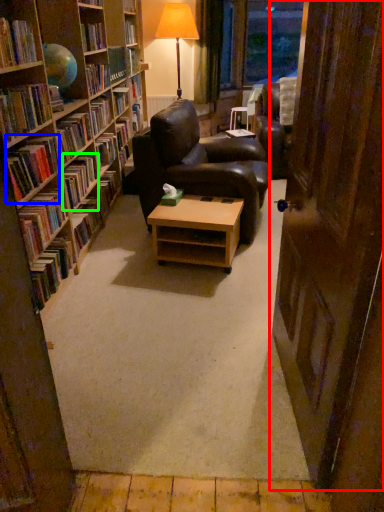
Question: Which object is positioned farthest from door (highlighted by a red box)? Select from book (highlighted by a blue box) and book (highlighted by a green box).

Choices:
 (A) book
 (B) book

Answer: (B)